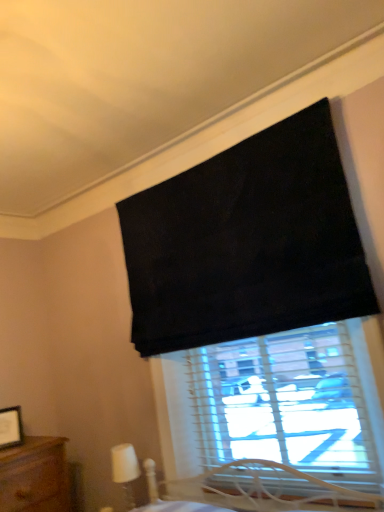
Question: Does wooden picture frame at lower left have a lesser height compared to white plastic table lamp at lower left?

Choices:
 (A) no
 (B) yes

Answer: (B)

Question: Can you see wooden picture frame at lower left touching white plastic table lamp at lower left?

Choices:
 (A) yes
 (B) no

Answer: (B)

Question: Is wooden picture frame at lower left positioned far away from white plastic table lamp at lower left?

Choices:
 (A) yes
 (B) no

Answer: (B)

Question: Would you say wooden picture frame at lower left contains white plastic table lamp at lower left?

Choices:
 (A) yes
 (B) no

Answer: (B)

Question: Is wooden picture frame at lower left further to camera compared to white plastic table lamp at lower left?

Choices:
 (A) no
 (B) yes

Answer: (B)

Question: Does wooden picture frame at lower left have a smaller size compared to white plastic table lamp at lower left?

Choices:
 (A) yes
 (B) no

Answer: (A)

Question: Does white plastic table lamp at lower left turn towards wooden picture frame at lower left?

Choices:
 (A) no
 (B) yes

Answer: (A)

Question: Is white plastic table lamp at lower left at the left side of wooden picture frame at lower left?

Choices:
 (A) no
 (B) yes

Answer: (A)

Question: Does white plastic table lamp at lower left lie in front of wooden picture frame at lower left?

Choices:
 (A) yes
 (B) no

Answer: (A)

Question: Is white plastic table lamp at lower left to the right of wooden picture frame at lower left from the viewer's perspective?

Choices:
 (A) no
 (B) yes

Answer: (B)

Question: Is white plastic table lamp at lower left further to camera compared to wooden picture frame at lower left?

Choices:
 (A) yes
 (B) no

Answer: (B)

Question: From the image's perspective, is white plastic table lamp at lower left under wooden picture frame at lower left?

Choices:
 (A) no
 (B) yes

Answer: (B)

Question: Visually, is wooden picture frame at lower left positioned to the left or to the right of white plastic table lamp at lower left?

Choices:
 (A) right
 (B) left

Answer: (B)